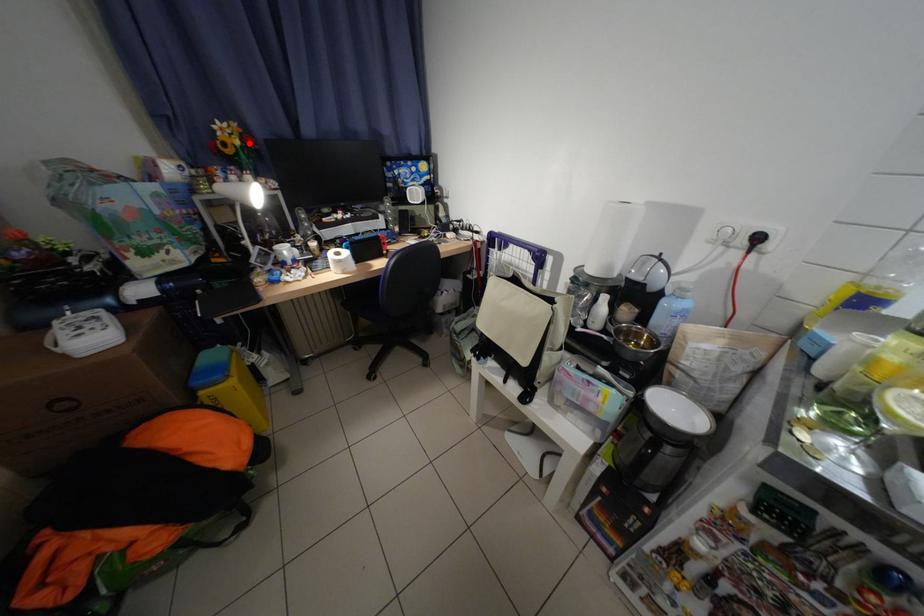
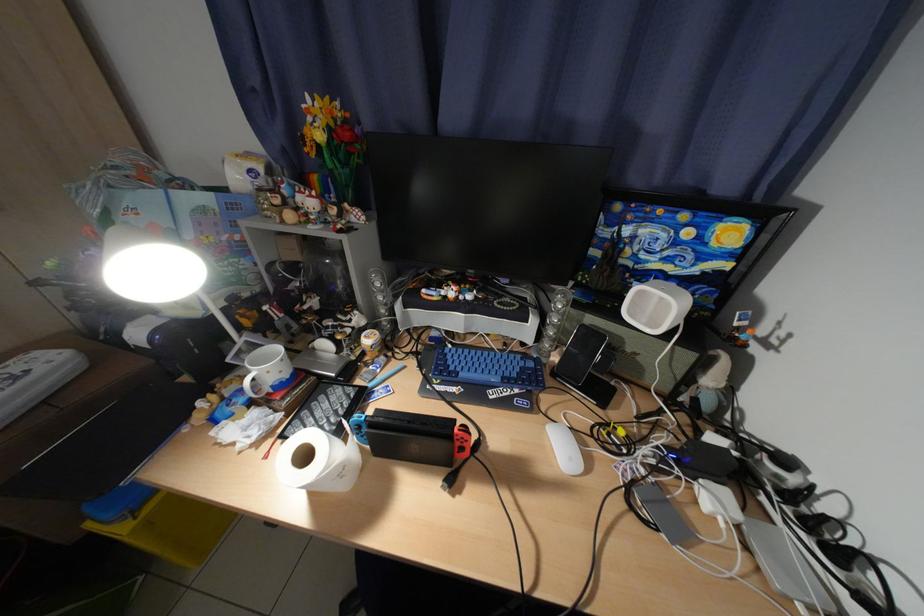
Locate, in the second image, the point that corresponds to the highlighted location in the first image.

(331, 138)